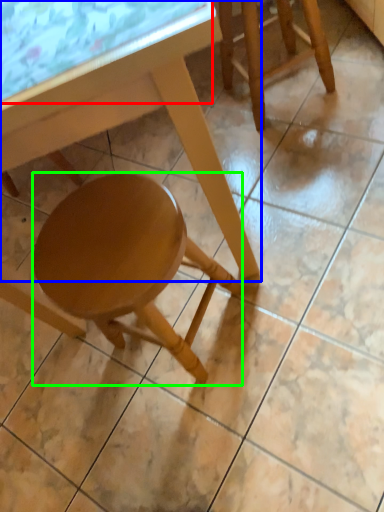
Question: Considering the real-world distances, which object is closest to glass table (highlighted by a red box)? table (highlighted by a blue box) or stool (highlighted by a green box).

Choices:
 (A) table
 (B) stool

Answer: (A)